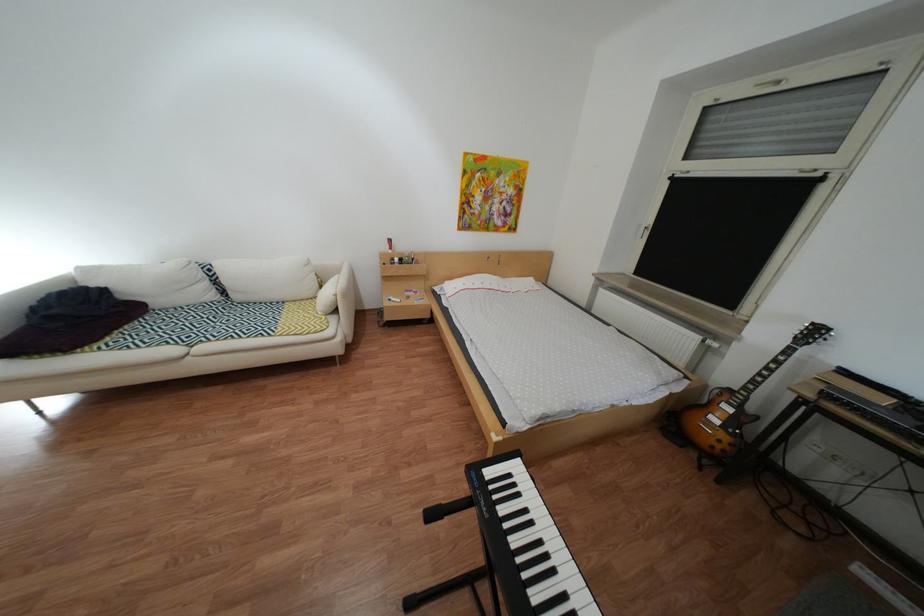
Where is `white radiator valve`? The width and height of the screenshot is (924, 616). white radiator valve is located at coordinates pyautogui.click(x=711, y=339).